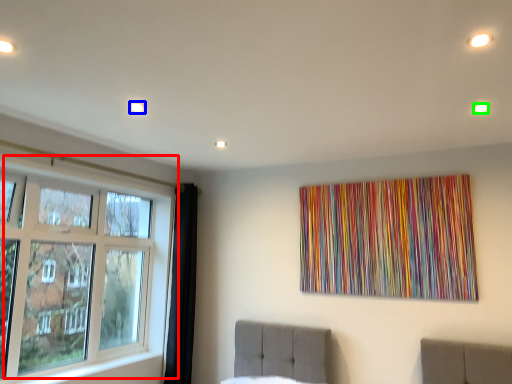
Question: Which object is the farthest from window (highlighted by a red box)? Choose among these: light (highlighted by a blue box) or light (highlighted by a green box).

Choices:
 (A) light
 (B) light

Answer: (B)